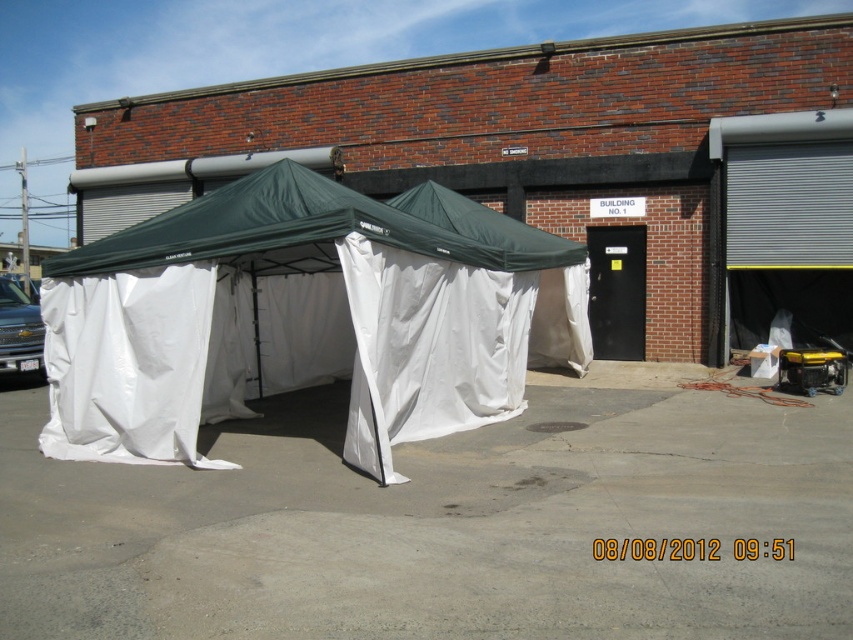
Is black metal/glass door at center further to the viewer compared to gray metallic garage door at right?

Yes.

Who is shorter, black metal/glass door at center or gray metallic garage door at right?

Standing shorter between the two is gray metallic garage door at right.

Which is in front, point (612, 275) or point (724, 132)?

Point (724, 132) is more forward.

The image size is (853, 640). I want to click on black metal/glass door at center, so click(x=618, y=291).

Does green fabric tent at center have a smaller size compared to black metal/glass door at center?

No.

Describe the element at coordinates (305, 317) in the screenshot. This screenshot has height=640, width=853. I see `green fabric tent at center` at that location.

Identify the location of green fabric tent at center. (305, 317).

Locate an element on the screen. The height and width of the screenshot is (640, 853). green fabric tent at center is located at coordinates (305, 317).

Between green fabric tent at center and gray metallic garage door at right, which one appears on the left side from the viewer's perspective?

From the viewer's perspective, green fabric tent at center appears more on the left side.

Identify the location of green fabric tent at center. The height and width of the screenshot is (640, 853). (305, 317).